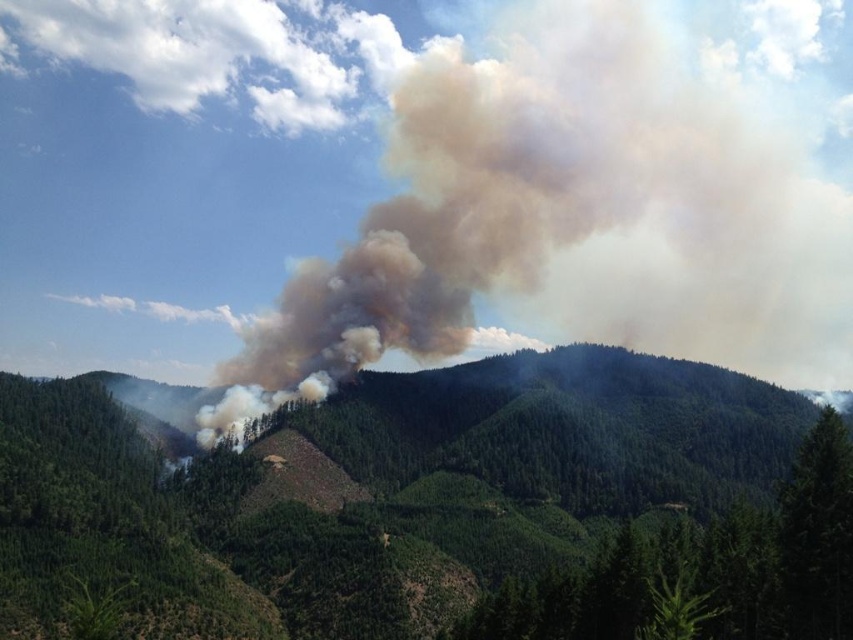
Question: Among these objects, which one is nearest to the camera?

Choices:
 (A) green forested mountain at center
 (B) brown smoke at center

Answer: (A)

Question: Which point is closer to the camera taking this photo?

Choices:
 (A) (314, 570)
 (B) (456, 45)

Answer: (A)

Question: Observing the image, what is the correct spatial positioning of green forested mountain at center in reference to brown smoke at center?

Choices:
 (A) below
 (B) above

Answer: (A)

Question: Considering the relative positions of green forested mountain at center and brown smoke at center in the image provided, where is green forested mountain at center located with respect to brown smoke at center?

Choices:
 (A) left
 (B) right

Answer: (A)

Question: Can you confirm if green forested mountain at center is smaller than brown smoke at center?

Choices:
 (A) no
 (B) yes

Answer: (B)